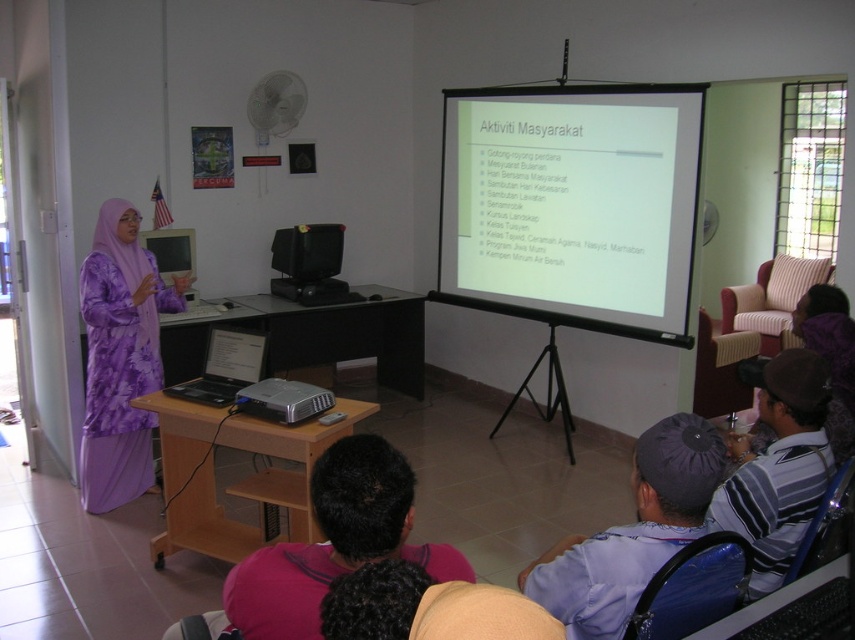
Who is shorter, purple floral robe at left or blue fabric robe at lower right?

Standing shorter between the two is blue fabric robe at lower right.

Between purple floral robe at left and blue fabric robe at lower right, which one is positioned lower?

blue fabric robe at lower right

Which is behind, point (134, 264) or point (585, 545)?

Point (134, 264)

Identify the location of purple floral robe at left. (121, 356).

Between white matte projection screen at upper center and striped fabric shirt at lower right, which one is positioned higher?

white matte projection screen at upper center is higher up.

Is white matte projection screen at upper center bigger than striped fabric shirt at lower right?

Yes.

This screenshot has width=855, height=640. I want to click on white matte projection screen at upper center, so click(572, 204).

Is purple floral robe at left taller than striped fabric shirt at lower right?

Correct, purple floral robe at left is much taller as striped fabric shirt at lower right.

Does purple floral robe at left have a smaller size compared to striped fabric shirt at lower right?

No, purple floral robe at left is not smaller than striped fabric shirt at lower right.

Does point (119, 228) come in front of point (777, 563)?

No.

Identify the location of purple floral robe at left. The image size is (855, 640). (121, 356).